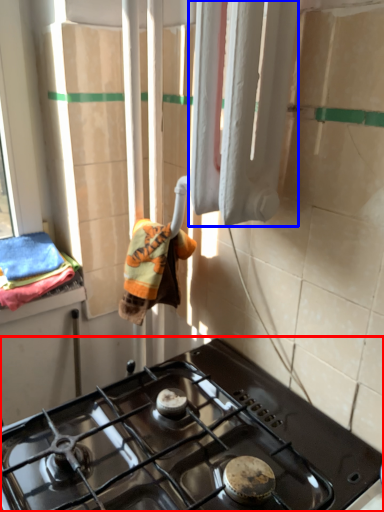
Question: Which object appears closest to the camera in this image, gas stove (highlighted by a red box) or curtain (highlighted by a blue box)?

Choices:
 (A) gas stove
 (B) curtain

Answer: (A)